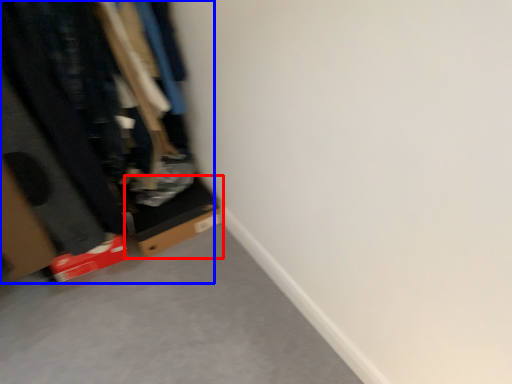
Question: Among these objects, which one is farthest to the camera, cardboard box (highlighted by a red box) or closet (highlighted by a blue box)?

Choices:
 (A) cardboard box
 (B) closet

Answer: (A)